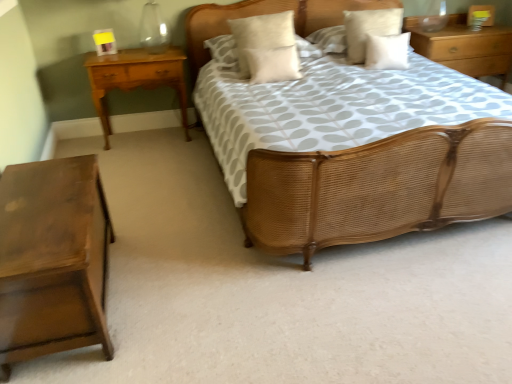
Question: Is white soft cushion at center, the fourth pillow in the right-to-left sequence, behind wooden nightstand at upper right, the 3th nightstand from the left?

Choices:
 (A) yes
 (B) no

Answer: (B)

Question: From the image's perspective, would you say white soft cushion at center, the fourth pillow in the right-to-left sequence, is shown under wooden nightstand at upper right, the 3th nightstand from the left?

Choices:
 (A) no
 (B) yes

Answer: (B)

Question: Is white soft cushion at center, which appears as the 2th pillow when viewed from the left, to the right of wooden nightstand at upper right, placed as the 1th nightstand when sorted from back to front, from the viewer's perspective?

Choices:
 (A) no
 (B) yes

Answer: (A)

Question: Considering the relative sizes of white soft cushion at center, the fourth pillow in the right-to-left sequence, and wooden nightstand at upper right, placed as the 1th nightstand when sorted from back to front, in the image provided, is white soft cushion at center, the fourth pillow in the right-to-left sequence, bigger than wooden nightstand at upper right, placed as the 1th nightstand when sorted from back to front,?

Choices:
 (A) yes
 (B) no

Answer: (B)

Question: Considering the relative sizes of white soft cushion at center, which appears as the 2th pillow when viewed from the left, and wooden nightstand at upper right, the 3th nightstand from the front, in the image provided, is white soft cushion at center, which appears as the 2th pillow when viewed from the left, shorter than wooden nightstand at upper right, the 3th nightstand from the front,?

Choices:
 (A) yes
 (B) no

Answer: (B)

Question: Considering their positions, is white soft pillow at upper center, the 5th pillow positioned from the right, located in front of or behind white soft pillow at upper right, the fifth pillow when ordered from left to right?

Choices:
 (A) behind
 (B) front

Answer: (A)

Question: Does point (301, 39) appear closer or farther from the camera than point (367, 56)?

Choices:
 (A) farther
 (B) closer

Answer: (A)

Question: From the image's perspective, is white soft pillow at upper center, positioned as the 1th pillow in left-to-right order, located above or below white soft pillow at upper right, the fifth pillow when ordered from left to right?

Choices:
 (A) below
 (B) above

Answer: (B)

Question: Considering the positions of white soft pillow at upper center, the 5th pillow positioned from the right, and white soft pillow at upper right, the first pillow in the right-to-left sequence, in the image, is white soft pillow at upper center, the 5th pillow positioned from the right, bigger or smaller than white soft pillow at upper right, the first pillow in the right-to-left sequence,?

Choices:
 (A) big
 (B) small

Answer: (A)

Question: Looking at their shapes, would you say woven wood bed at center is wider or thinner than white soft cushion at center, the fourth pillow in the right-to-left sequence?

Choices:
 (A) wide
 (B) thin

Answer: (A)

Question: Considering the positions of point (389, 172) and point (234, 21), is point (389, 172) closer or farther from the camera than point (234, 21)?

Choices:
 (A) closer
 (B) farther

Answer: (A)

Question: Is woven wood bed at center in front of or behind white soft cushion at center, which appears as the 2th pillow when viewed from the left, in the image?

Choices:
 (A) front
 (B) behind

Answer: (A)

Question: Is woven wood bed at center inside the boundaries of white soft cushion at center, which appears as the 2th pillow when viewed from the left, or outside?

Choices:
 (A) outside
 (B) inside

Answer: (A)

Question: From their relative heights in the image, would you say light brown wood nightstand at left, placed as the third nightstand when sorted from right to left, is taller or shorter than woven wood bed at center?

Choices:
 (A) short
 (B) tall

Answer: (A)

Question: In terms of size, does light brown wood nightstand at left, the 2th nightstand viewed from the back, appear bigger or smaller than woven wood bed at center?

Choices:
 (A) big
 (B) small

Answer: (B)